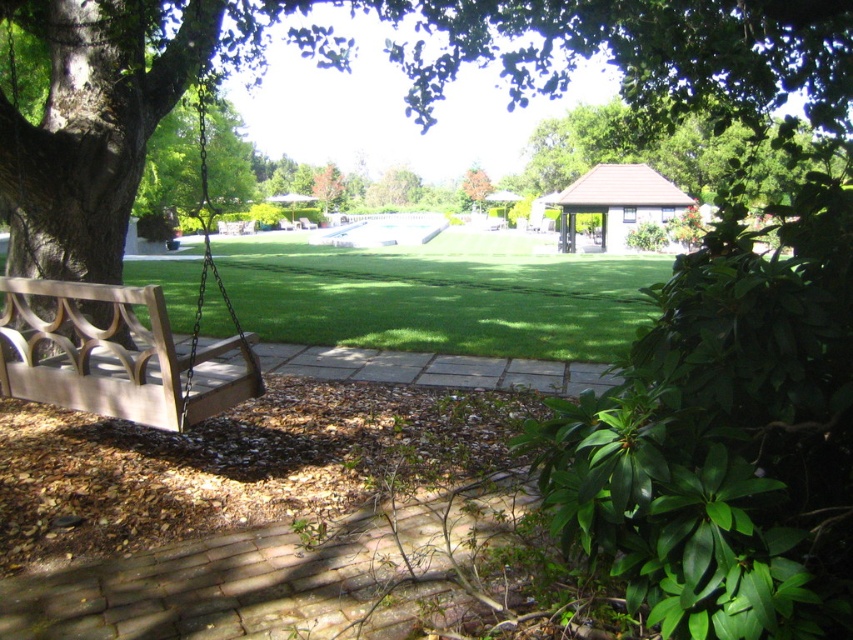
Between point (119, 291) and point (474, 173), which one is positioned in front?

Point (119, 291) is in front.

Describe the element at coordinates (115, 356) in the screenshot. I see `wooden park bench at left` at that location.

Image resolution: width=853 pixels, height=640 pixels. I want to click on wooden park bench at left, so click(115, 356).

This screenshot has width=853, height=640. What are the coordinates of `brown wood tree at left` in the screenshot? It's located at (393, 64).

Does point (585, 0) come farther from viewer compared to point (107, 388)?

Yes, point (585, 0) is farther from viewer.

Can you confirm if brown wood tree at left is taller than wooden park bench at left?

Correct, brown wood tree at left is much taller as wooden park bench at left.

Is point (64, 90) farther from viewer compared to point (215, 358)?

No.

Find the location of a particular element. brown wood tree at left is located at coordinates (393, 64).